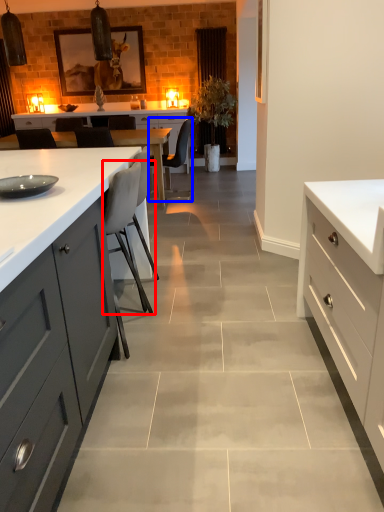
Question: Which point is closer to the camera, chair (highlighted by a red box) or chair (highlighted by a blue box)?

Choices:
 (A) chair
 (B) chair

Answer: (A)